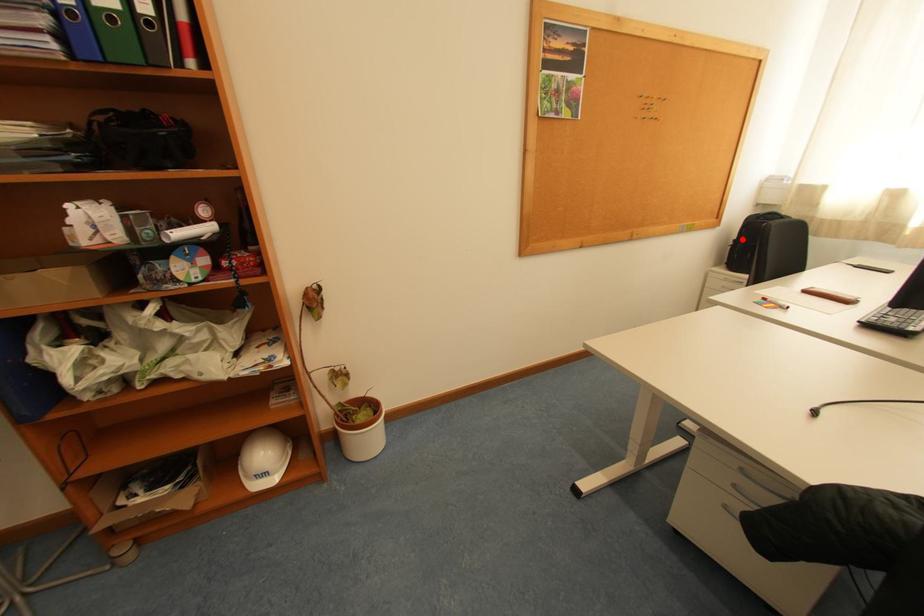
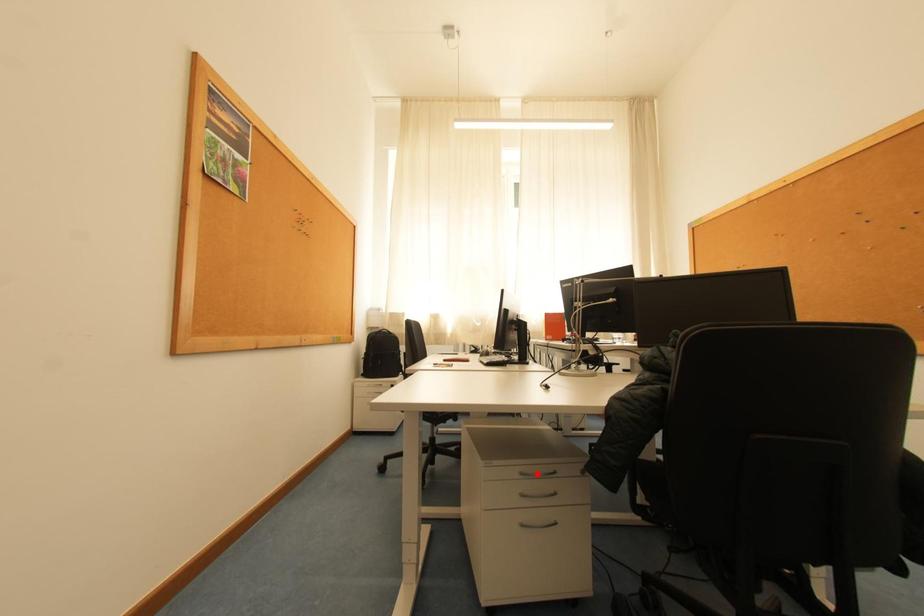
I am providing you with two images of the same scene from different viewpoints. A red point is marked on the first image and another point is marked on the second image. Is the marked point in image1 the same physical position as the marked point in image2?

No